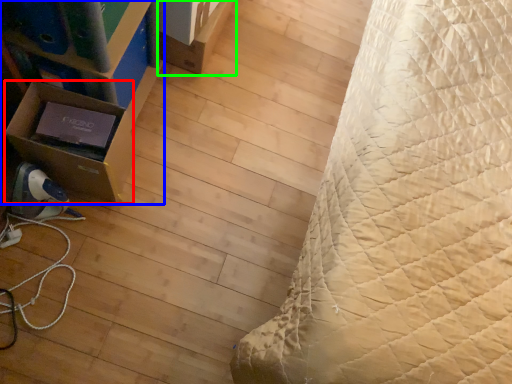
Question: Estimate the real-world distances between objects in this image. Which object is farther from cardboard box (highlighted by a red box), furniture (highlighted by a blue box) or cardboard box (highlighted by a green box)?

Choices:
 (A) furniture
 (B) cardboard box

Answer: (B)